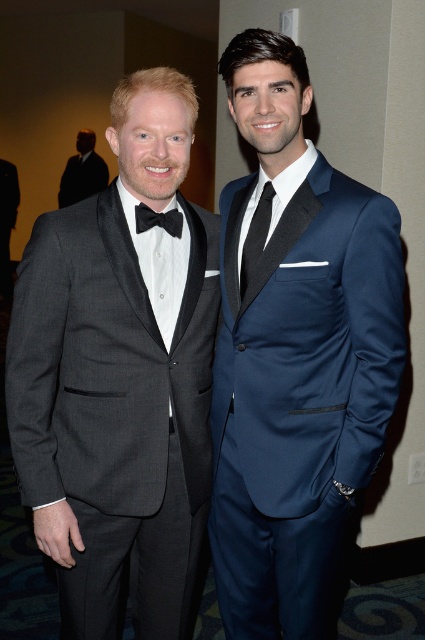
Does matte black suit at left have a lesser width compared to black satin tie at center?

In fact, matte black suit at left might be wider than black satin tie at center.

Which is behind, point (87, 150) or point (243, 260)?

Point (87, 150)

Is point (71, 200) positioned in front of point (258, 218)?

No, (71, 200) is further to viewer.

At what (x,y) coordinates should I click in order to perform the action: click on matte black suit at left. Please return your answer as a coordinate pair (x, y). The width and height of the screenshot is (425, 640). Looking at the image, I should click on (82, 172).

Is matte black tuxedo at left to the right of black satin bow tie at left from the viewer's perspective?

Incorrect, matte black tuxedo at left is not on the right side of black satin bow tie at left.

Which is more to the left, matte black tuxedo at left or black satin bow tie at left?

matte black tuxedo at left is more to the left.

Locate an element on the screen. Image resolution: width=425 pixels, height=640 pixels. matte black tuxedo at left is located at coordinates (119, 378).

Does black satin tie at center have a smaller size compared to black satin bow tie at left?

No.

The width and height of the screenshot is (425, 640). Identify the location of black satin tie at center. (255, 236).